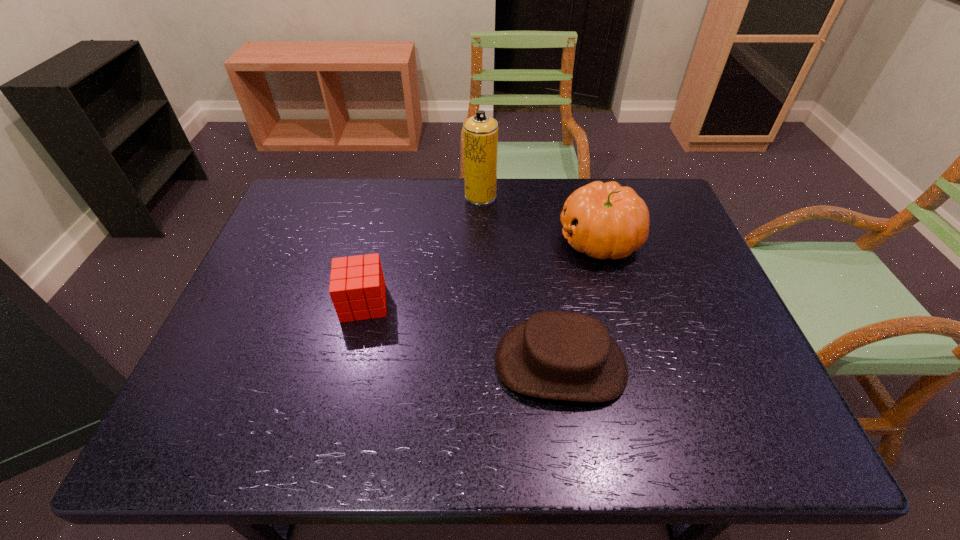
Where is `free space located 0.390m on the carved face of the pumpkin`? The height and width of the screenshot is (540, 960). free space located 0.390m on the carved face of the pumpkin is located at coordinates (419, 240).

Where is `vacant area situated 0.120m on the front of the cube`? vacant area situated 0.120m on the front of the cube is located at coordinates (348, 367).

At what (x,y) coordinates should I click in order to perform the action: click on free location located on the left of the nearest object. Please return your answer as a coordinate pair (x, y). The width and height of the screenshot is (960, 540). Looking at the image, I should click on (421, 363).

You are a GUI agent. You are given a task and a screenshot of the screen. Output one action in this format:
    pyautogui.click(x=<x>, y=<y>)
    Task: Click on the aerosol can that is at the far edge
    Image resolution: width=960 pixels, height=540 pixels.
    Given the screenshot: What is the action you would take?
    pyautogui.click(x=480, y=132)

Identify the location of pumpkin that is at the far edge. (604, 220).

At what (x,y) coordinates should I click in order to perform the action: click on object that is at the right edge. Please return your answer as a coordinate pair (x, y). Looking at the image, I should click on (604, 220).

Identify the location of object located at the far right corner. (604, 220).

In the image, there is a desktop. At what (x,y) coordinates should I click in order to perform the action: click on free space at the far edge. Please return your answer as a coordinate pair (x, y). The image size is (960, 540). Looking at the image, I should click on (461, 186).

The width and height of the screenshot is (960, 540). I want to click on vacant area at the left edge of the desktop, so click(x=255, y=340).

Identify the location of free space at the right edge of the desktop. (695, 251).